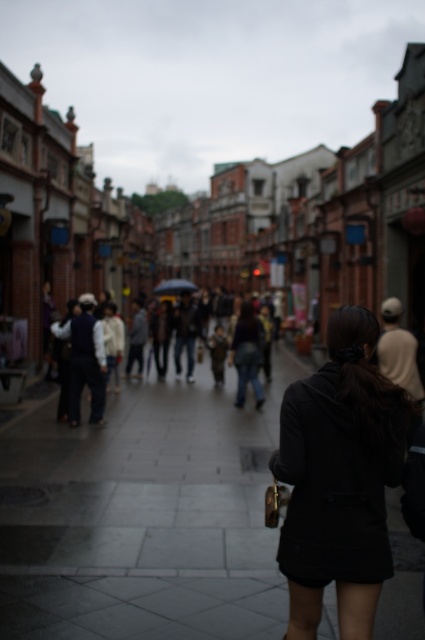
Question: Is smooth concrete pavement at center positioned in front of black matte coat at center?

Choices:
 (A) no
 (B) yes

Answer: (A)

Question: In this image, where is smooth concrete pavement at center located relative to black matte coat at center?

Choices:
 (A) below
 (B) above

Answer: (A)

Question: Which point is closer to the camera?

Choices:
 (A) smooth concrete pavement at center
 (B) black matte coat at center
 (C) transparent plastic umbrella at center

Answer: (B)

Question: Among these objects, which one is nearest to the camera?

Choices:
 (A) transparent plastic umbrella at center
 (B) smooth concrete pavement at center
 (C) black matte coat at center

Answer: (C)

Question: Which point appears farthest from the camera in this image?

Choices:
 (A) (158, 282)
 (B) (356, 618)
 (C) (147, 508)

Answer: (A)

Question: Does black matte coat at center have a smaller size compared to transparent plastic umbrella at center?

Choices:
 (A) no
 (B) yes

Answer: (B)